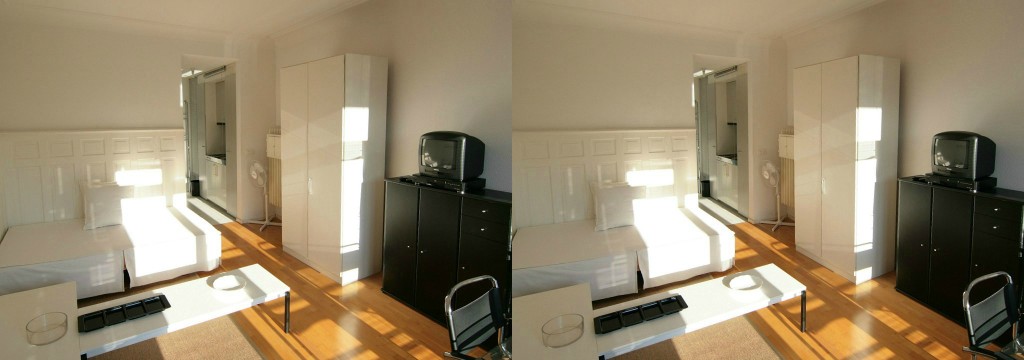
Find the location of `tv`. tv is located at coordinates (458, 152), (973, 155).